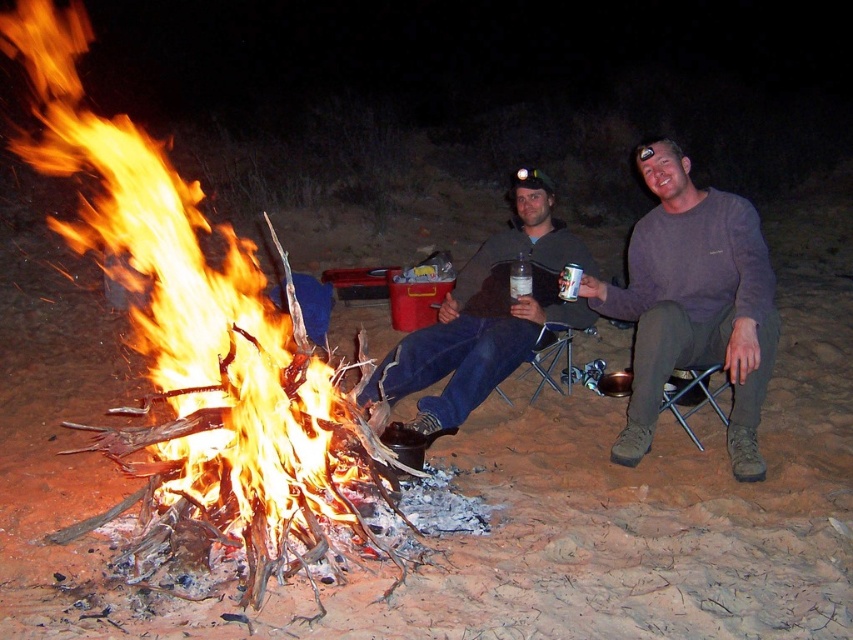
Which of these two, purple sweater at center or metallic silver can at center, stands shorter?

With less height is metallic silver can at center.

Between point (763, 352) and point (563, 291), which one is positioned behind?

The point (563, 291) is behind.

Measure the distance between point [664,324] and camera.

Point [664,324] and camera are 12.27 feet apart.

Image resolution: width=853 pixels, height=640 pixels. I want to click on purple sweater at center, so click(x=693, y=301).

Measure the distance between matte gray sweater at center and camera.

matte gray sweater at center is 11.48 feet from camera.

The image size is (853, 640). What are the coordinates of `matte gray sweater at center` in the screenshot? It's located at (692, 301).

Locate an element on the screen. matte gray sweater at center is located at coordinates (692, 301).

Is point (113, 410) positioned behind point (401, 394)?

No, it is not.

Who is more distant from viewer, (224, 230) or (738, 256)?

The point (224, 230) is more distant.

This screenshot has width=853, height=640. Find the location of `flaming wood fire at left`. flaming wood fire at left is located at coordinates (202, 326).